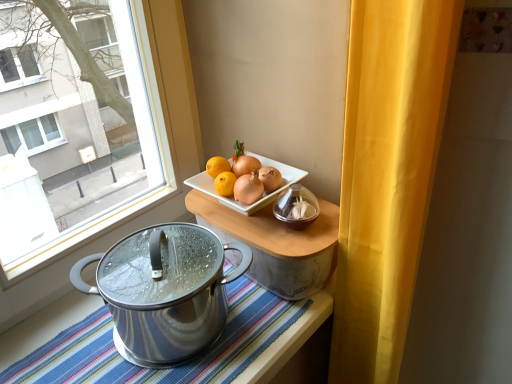
Question: Should I look upward or downward to see striped fabric tablecloth at lower center?

Choices:
 (A) up
 (B) down

Answer: (B)

Question: Can you confirm if wooden tray at center is positioned to the left of striped fabric tablecloth at lower center?

Choices:
 (A) yes
 (B) no

Answer: (B)

Question: Considering the relative sizes of wooden tray at center and striped fabric tablecloth at lower center in the image provided, is wooden tray at center bigger than striped fabric tablecloth at lower center?

Choices:
 (A) no
 (B) yes

Answer: (A)

Question: Can you confirm if wooden tray at center is thinner than striped fabric tablecloth at lower center?

Choices:
 (A) yes
 (B) no

Answer: (A)

Question: From a real-world perspective, is wooden tray at center located beneath striped fabric tablecloth at lower center?

Choices:
 (A) yes
 (B) no

Answer: (B)

Question: Is the position of wooden tray at center less distant than that of striped fabric tablecloth at lower center?

Choices:
 (A) yes
 (B) no

Answer: (B)

Question: Is wooden tray at center looking in the opposite direction of striped fabric tablecloth at lower center?

Choices:
 (A) no
 (B) yes

Answer: (A)

Question: Is polished stainless steel pot at lower left at the right side of wooden tray at center?

Choices:
 (A) yes
 (B) no

Answer: (B)

Question: Can we say polished stainless steel pot at lower left lies outside wooden tray at center?

Choices:
 (A) no
 (B) yes

Answer: (B)

Question: Are polished stainless steel pot at lower left and wooden tray at center far apart?

Choices:
 (A) no
 (B) yes

Answer: (A)

Question: Is polished stainless steel pot at lower left thinner than wooden tray at center?

Choices:
 (A) no
 (B) yes

Answer: (B)

Question: Is polished stainless steel pot at lower left at the left side of wooden tray at center?

Choices:
 (A) yes
 (B) no

Answer: (A)

Question: Is wooden tray at center a part of polished stainless steel pot at lower left?

Choices:
 (A) no
 (B) yes

Answer: (A)

Question: Is striped fabric tablecloth at lower center aimed at yellow fabric curtain at right?

Choices:
 (A) yes
 (B) no

Answer: (B)